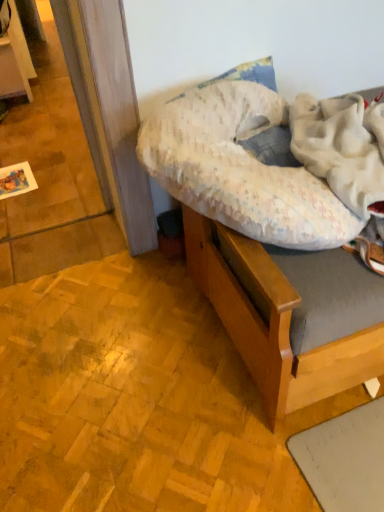
I want to click on wooden hospital bed at upper right, so click(x=266, y=245).

Describe the element at coordinates (266, 245) in the screenshot. I see `wooden hospital bed at upper right` at that location.

What do you see at coordinates (240, 170) in the screenshot?
I see `fluffy white pillow at center` at bounding box center [240, 170].

Find the location of a particular element. The height and width of the screenshot is (512, 384). fluffy white pillow at center is located at coordinates (240, 170).

At what (x,y) coordinates should I click in order to perform the action: click on wooden hospital bed at upper right. Please return your answer as a coordinate pair (x, y). The image size is (384, 512). Looking at the image, I should click on (266, 245).

From the picture: Is wooden hospital bed at upper right at the right side of fluffy white pillow at center?

Correct, you'll find wooden hospital bed at upper right to the right of fluffy white pillow at center.

Does wooden hospital bed at upper right lie behind fluffy white pillow at center?

Yes, it is.

Is point (230, 325) less distant than point (305, 214)?

No.

From the image's perspective, which is above, wooden hospital bed at upper right or fluffy white pillow at center?

fluffy white pillow at center, from the image's perspective.

From a real-world perspective, is wooden hospital bed at upper right below fluffy white pillow at center?

Yes, from a real-world perspective, wooden hospital bed at upper right is beneath fluffy white pillow at center.

Is wooden hospital bed at upper right wider than fluffy white pillow at center?

Yes, wooden hospital bed at upper right is wider than fluffy white pillow at center.

Who is taller, wooden hospital bed at upper right or fluffy white pillow at center?

With more height is wooden hospital bed at upper right.

Between wooden hospital bed at upper right and fluffy white pillow at center, which one has smaller size?

Smaller between the two is fluffy white pillow at center.

Is wooden hospital bed at upper right outside of fluffy white pillow at center?

wooden hospital bed at upper right is positioned outside fluffy white pillow at center.

Is wooden hospital bed at upper right not close to fluffy white pillow at center?

No, wooden hospital bed at upper right is in close proximity to fluffy white pillow at center.

Could you tell me if wooden hospital bed at upper right is facing fluffy white pillow at center?

No, wooden hospital bed at upper right is not turned towards fluffy white pillow at center.

How many degrees apart are the facing directions of wooden hospital bed at upper right and fluffy white pillow at center?

The angular difference between wooden hospital bed at upper right and fluffy white pillow at center is 0.348 degrees.

Measure the distance from wooden hospital bed at upper right to fluffy white pillow at center.

3.73 inches.

The image size is (384, 512). I want to click on pillow in front of the wooden hospital bed at upper right, so click(240, 170).

Which object is positioned more to the right, fluffy white pillow at center or wooden hospital bed at upper right?

Positioned to the right is wooden hospital bed at upper right.

Is fluffy white pillow at center in front of or behind wooden hospital bed at upper right in the image?

Clearly, fluffy white pillow at center is in front of wooden hospital bed at upper right.

Is point (292, 218) positioned behind point (353, 339)?

No, it is in front of (353, 339).

From the image's perspective, is fluffy white pillow at center located above wooden hospital bed at upper right?

Correct, fluffy white pillow at center appears higher than wooden hospital bed at upper right in the image.

From a real-world perspective, is fluffy white pillow at center below wooden hospital bed at upper right?

Actually, fluffy white pillow at center is physically above wooden hospital bed at upper right in the real world.

Considering the sizes of objects fluffy white pillow at center and wooden hospital bed at upper right in the image provided, who is thinner, fluffy white pillow at center or wooden hospital bed at upper right?

fluffy white pillow at center is thinner.

Between fluffy white pillow at center and wooden hospital bed at upper right, which one has more height?

Standing taller between the two is wooden hospital bed at upper right.

Does fluffy white pillow at center have a smaller size compared to wooden hospital bed at upper right?

Yes.

Is fluffy white pillow at center completely or partially outside of wooden hospital bed at upper right?

That's incorrect, fluffy white pillow at center is not completely outside wooden hospital bed at upper right.

Is fluffy white pillow at center not near wooden hospital bed at upper right?

No, fluffy white pillow at center is not far away from wooden hospital bed at upper right.

Is fluffy white pillow at center facing away from wooden hospital bed at upper right?

Yes, fluffy white pillow at center's orientation is away from wooden hospital bed at upper right.

How distant is fluffy white pillow at center from wooden hospital bed at upper right?

fluffy white pillow at center and wooden hospital bed at upper right are 3.73 inches apart from each other.

Where is `hospital bed located behind the fluffy white pillow at center`? The width and height of the screenshot is (384, 512). hospital bed located behind the fluffy white pillow at center is located at coordinates (266, 245).

The width and height of the screenshot is (384, 512). Identify the location of hospital bed below the fluffy white pillow at center (from a real-world perspective). (266, 245).

Locate an element on the screen. The height and width of the screenshot is (512, 384). hospital bed below the fluffy white pillow at center (from the image's perspective) is located at coordinates (266, 245).